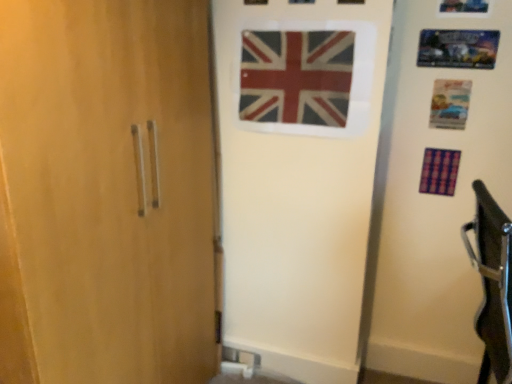
Question: In the image, is red and white fabric flag at center, the 1th flag from the top, positioned in front of or behind purple fabric flag at right, the 2th flag when ordered from front to back?

Choices:
 (A) behind
 (B) front

Answer: (B)

Question: Considering the positions of point (294, 38) and point (435, 170), is point (294, 38) closer or farther from the camera than point (435, 170)?

Choices:
 (A) closer
 (B) farther

Answer: (A)

Question: Is red and white fabric flag at center, the 1th flag from the top, spatially inside purple fabric flag at right, acting as the 1th flag starting from the back, or outside of it?

Choices:
 (A) inside
 (B) outside

Answer: (B)

Question: From the image's perspective, is purple fabric flag at right, the 2th flag when ordered from front to back, positioned above or below red and white fabric flag at center, the 1th flag from the top?

Choices:
 (A) above
 (B) below

Answer: (B)

Question: Is purple fabric flag at right, acting as the 1th flag starting from the back, to the left or to the right of red and white fabric flag at center, which is the 2th flag in right-to-left order, in the image?

Choices:
 (A) left
 (B) right

Answer: (B)

Question: Is purple fabric flag at right, which is counted as the first flag, starting from the right, wider or thinner than red and white fabric flag at center, which is the 2th flag in right-to-left order?

Choices:
 (A) thin
 (B) wide

Answer: (B)

Question: Considering the positions of purple fabric flag at right, arranged as the 1th flag when ordered from the bottom, and red and white fabric flag at center, which is the 2th flag in right-to-left order, in the image, is purple fabric flag at right, arranged as the 1th flag when ordered from the bottom, bigger or smaller than red and white fabric flag at center, which is the 2th flag in right-to-left order,?

Choices:
 (A) small
 (B) big

Answer: (A)